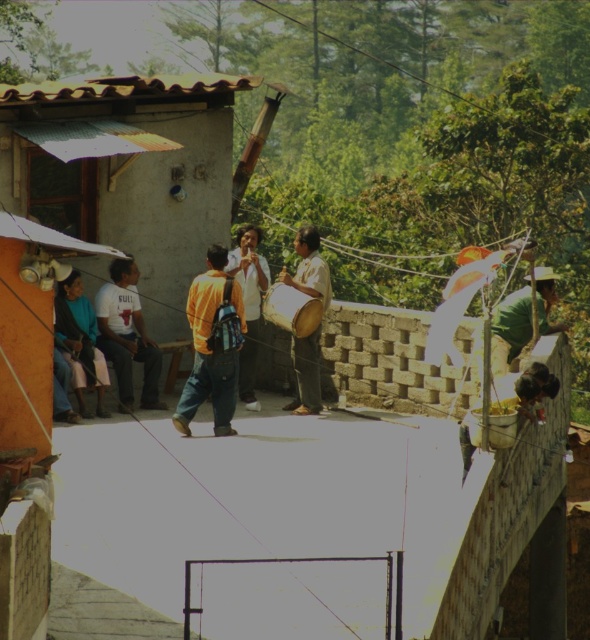
Question: Does orange matte backpack at center have a smaller size compared to yellow fabric shirt at center?

Choices:
 (A) yes
 (B) no

Answer: (A)

Question: Estimate the real-world distances between objects in this image. Which object is closer to the yellow fabric shirt at center?

Choices:
 (A) white matte t-shirt at left
 (B) orange matte backpack at center
 (C) wooden drum at center
 (D) blue fabric jacket at lower left

Answer: (C)

Question: Which object is farther from the camera taking this photo?

Choices:
 (A) yellow fabric shirt at center
 (B) wooden drum at center
 (C) orange matte backpack at center
 (D) blue fabric jacket at lower left

Answer: (A)

Question: Can you confirm if white matte t-shirt at left is wider than yellow fabric shirt at center?

Choices:
 (A) no
 (B) yes

Answer: (B)

Question: Which point is closer to the camera?

Choices:
 (A) yellow fabric shirt at center
 (B) wooden drum at center
 (C) blue fabric jacket at lower left
 (D) orange matte backpack at center

Answer: (D)

Question: Does wooden drum at center appear on the left side of blue fabric jacket at lower left?

Choices:
 (A) yes
 (B) no

Answer: (B)